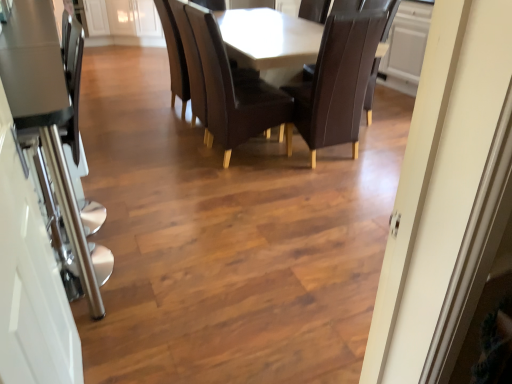
Question: From the image's perspective, would you say leather at center, which is counted as the second chair, starting from the right, is shown under dark brown leather chair at center, which appears as the first chair when viewed from the right?

Choices:
 (A) no
 (B) yes

Answer: (B)

Question: From a real-world perspective, does leather at center, which is counted as the second chair, starting from the right, sit lower than dark brown leather chair at center, which appears as the first chair when viewed from the right?

Choices:
 (A) no
 (B) yes

Answer: (A)

Question: Can you confirm if leather at center, which is counted as the second chair, starting from the right, is wider than dark brown leather chair at center, which appears as the first chair when viewed from the right?

Choices:
 (A) yes
 (B) no

Answer: (A)

Question: Can you confirm if leather at center, which is counted as the second chair, starting from the right, is taller than dark brown leather chair at center, which ranks as the second chair in left-to-right order?

Choices:
 (A) yes
 (B) no

Answer: (A)

Question: Considering the relative sizes of leather at center, which is counted as the second chair, starting from the right, and dark brown leather chair at center, which appears as the first chair when viewed from the right, in the image provided, is leather at center, which is counted as the second chair, starting from the right, smaller than dark brown leather chair at center, which appears as the first chair when viewed from the right,?

Choices:
 (A) no
 (B) yes

Answer: (A)

Question: From the image's perspective, is leather at center, the first chair positioned from the left, located above or below clear glass door at left?

Choices:
 (A) above
 (B) below

Answer: (A)

Question: In terms of height, does leather at center, the first chair positioned from the left, look taller or shorter compared to clear glass door at left?

Choices:
 (A) short
 (B) tall

Answer: (A)

Question: From a real-world perspective, is leather at center, the first chair positioned from the left, above or below clear glass door at left?

Choices:
 (A) above
 (B) below

Answer: (B)

Question: Is leather at center, the first chair positioned from the left, in front of or behind clear glass door at left in the image?

Choices:
 (A) behind
 (B) front

Answer: (A)

Question: From a real-world perspective, is clear glass door at left physically located above or below leather at center, which is counted as the second chair, starting from the right?

Choices:
 (A) above
 (B) below

Answer: (A)

Question: Looking at their shapes, would you say clear glass door at left is wider or thinner than leather at center, which is counted as the second chair, starting from the right?

Choices:
 (A) thin
 (B) wide

Answer: (A)

Question: Considering the positions of point tap(13, 291) and point tap(225, 114), is point tap(13, 291) closer or farther from the camera than point tap(225, 114)?

Choices:
 (A) closer
 (B) farther

Answer: (A)

Question: Considering the positions of clear glass door at left and leather at center, the first chair positioned from the left, in the image, is clear glass door at left taller or shorter than leather at center, the first chair positioned from the left,?

Choices:
 (A) tall
 (B) short

Answer: (A)

Question: In terms of width, does clear glass door at left look wider or thinner when compared to dark brown leather chair at center, which ranks as the second chair in left-to-right order?

Choices:
 (A) wide
 (B) thin

Answer: (B)

Question: Does point (3, 304) appear closer or farther from the camera than point (369, 31)?

Choices:
 (A) farther
 (B) closer

Answer: (B)